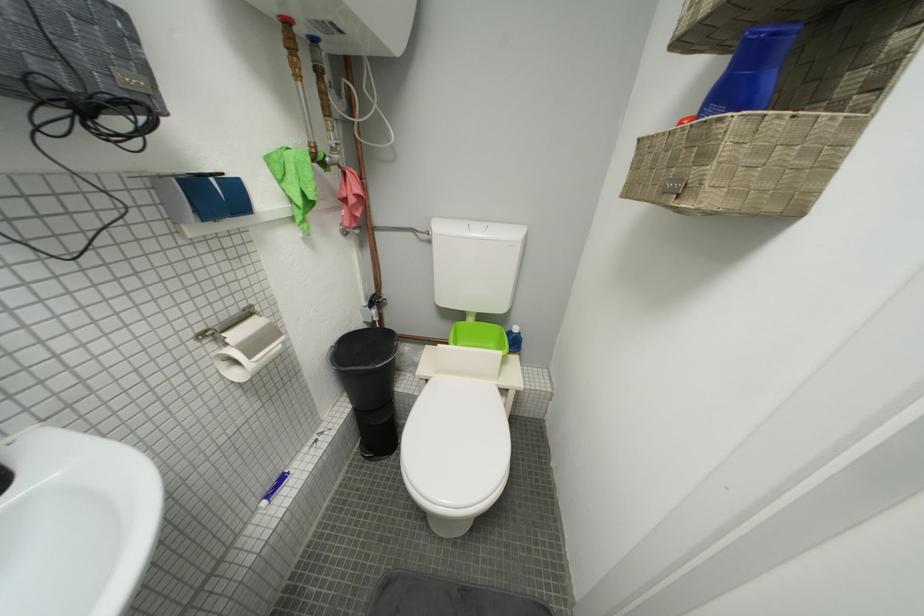
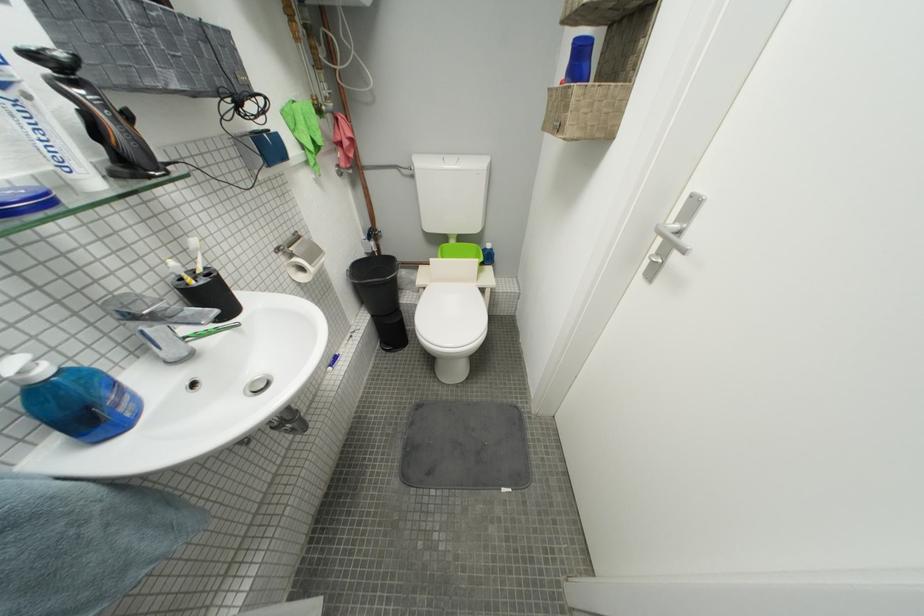
In the second image, find the point that corresponds to (x=108, y=349) in the first image.

(247, 252)